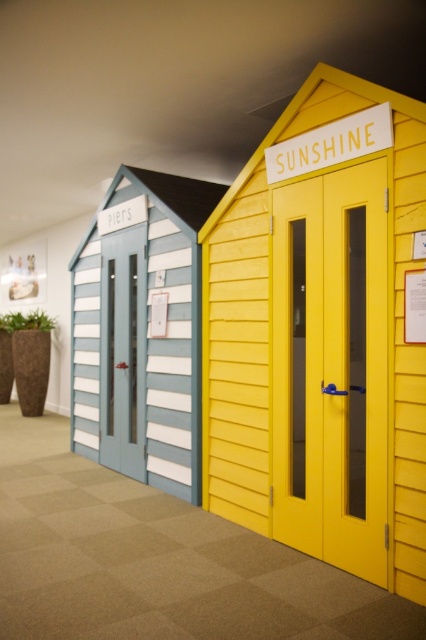
Can you confirm if yellow matte door at center is positioned to the right of matte white door at center?

Indeed, yellow matte door at center is positioned on the right side of matte white door at center.

Is yellow matte door at center to the left of matte white door at center from the viewer's perspective?

In fact, yellow matte door at center is to the right of matte white door at center.

I want to click on yellow matte door at center, so click(x=331, y=369).

Is yellow wooden beach hut at center bigger than matte white door at center?

Yes.

This screenshot has height=640, width=426. What are the coordinates of `yellow wooden beach hut at center` in the screenshot? It's located at (255, 308).

Who is more distant from viewer, (207, 355) or (103, 390)?

The point (103, 390) is behind.

Identify the location of yellow wooden beach hut at center. (255, 308).

What do you see at coordinates (141, 330) in the screenshot? I see `blue striped wooden hut at center` at bounding box center [141, 330].

You are a GUI agent. You are given a task and a screenshot of the screen. Output one action in this format:
    pyautogui.click(x=<x>, y=<y>)
    Task: Click on the blue striped wooden hut at center
    This screenshot has height=640, width=426.
    Given the screenshot: What is the action you would take?
    pyautogui.click(x=141, y=330)